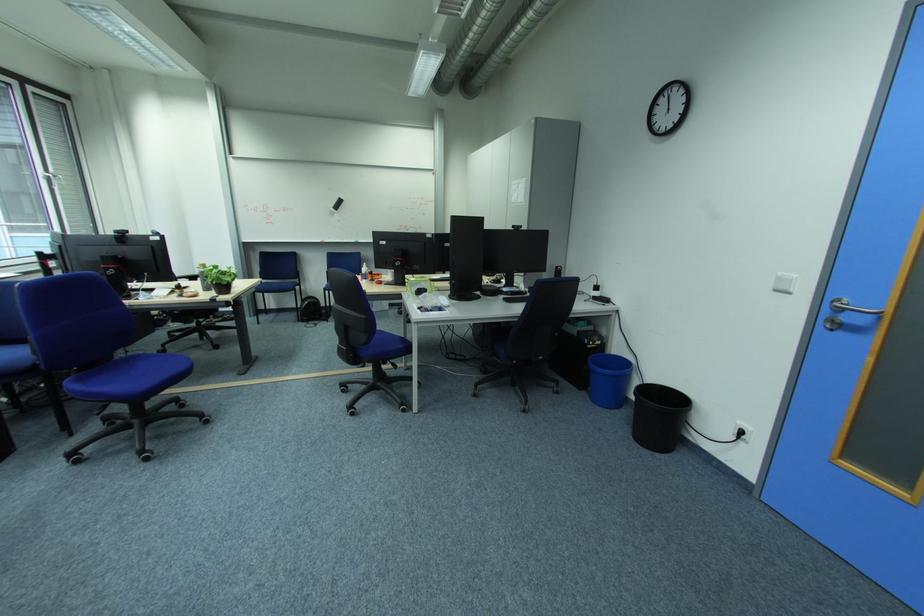
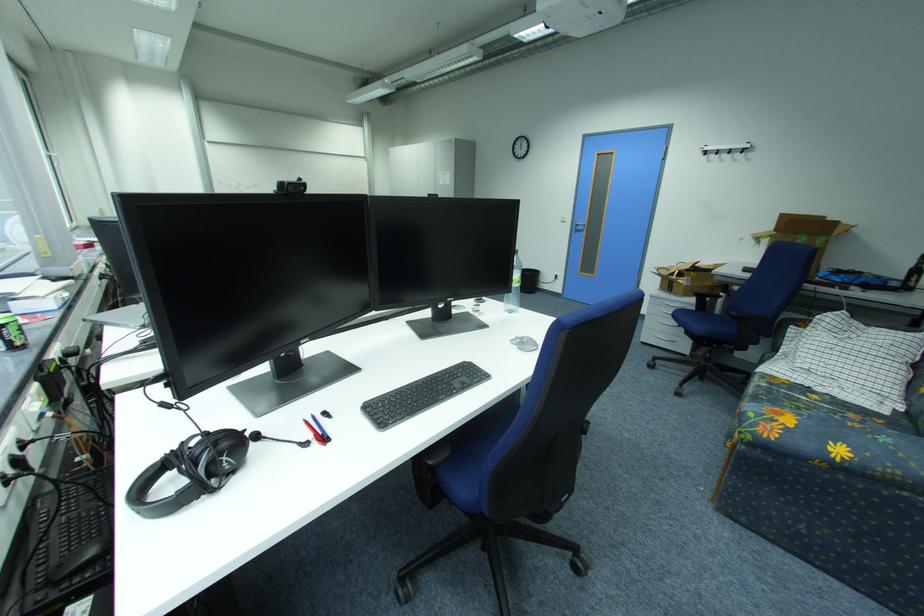
Which direction would the cameraman need to move to produce the second image?

The movement direction of the cameraman is left, backward.